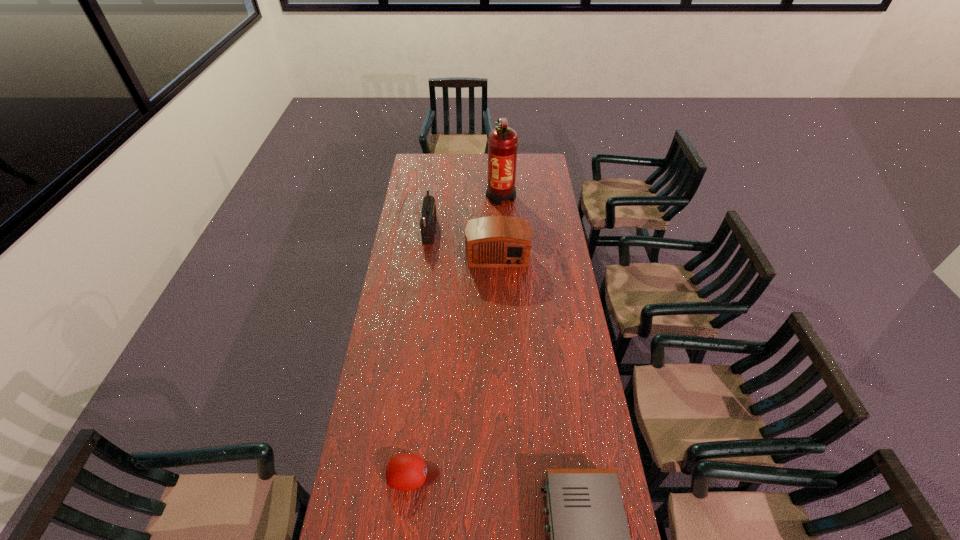
I want to click on radio receiver that is at the left edge, so click(428, 211).

At what (x,y) coordinates should I click in order to perform the action: click on baseball cap situated at the left edge. Please return your answer as a coordinate pair (x, y). Looking at the image, I should click on click(x=405, y=472).

I want to click on free point at the far edge, so click(465, 169).

In the image, there is a desktop. At what (x,y) coordinates should I click in order to perform the action: click on free space at the left edge. Please return your answer as a coordinate pair (x, y). Looking at the image, I should click on (402, 294).

At what (x,y) coordinates should I click in order to perform the action: click on vacant space at the right edge. Please return your answer as a coordinate pair (x, y). Looking at the image, I should click on (550, 226).

The image size is (960, 540). I want to click on free region at the far left corner of the desktop, so click(x=420, y=157).

At what (x,y) coordinates should I click in order to perform the action: click on free space that is in between the shortest object and the tallest object. Please return your answer as a coordinate pair (x, y). This screenshot has height=540, width=960. Looking at the image, I should click on (457, 334).

What are the coordinates of `empty space between the shortest object and the fourth shortest object` in the screenshot? It's located at (421, 350).

This screenshot has width=960, height=540. In order to click on empty location between the baseball cap and the farthest object in this screenshot , I will do `click(457, 334)`.

This screenshot has height=540, width=960. What are the coordinates of `vacant region between the third shortest object and the second tallest object` in the screenshot? It's located at (464, 240).